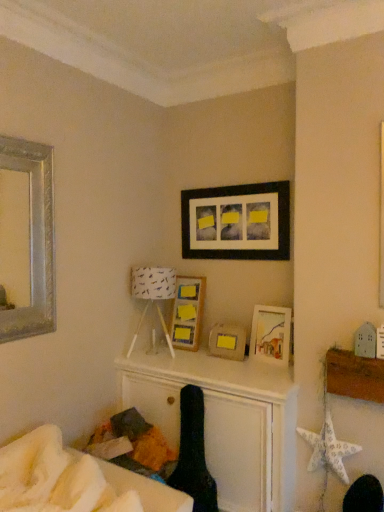
Find the location of `empty space that is ontop of matte black picture frame at upper center, positioned as the 2th picture frame in right-to-left order (from a real-world perspective)`. empty space that is ontop of matte black picture frame at upper center, positioned as the 2th picture frame in right-to-left order (from a real-world perspective) is located at coordinates (244, 179).